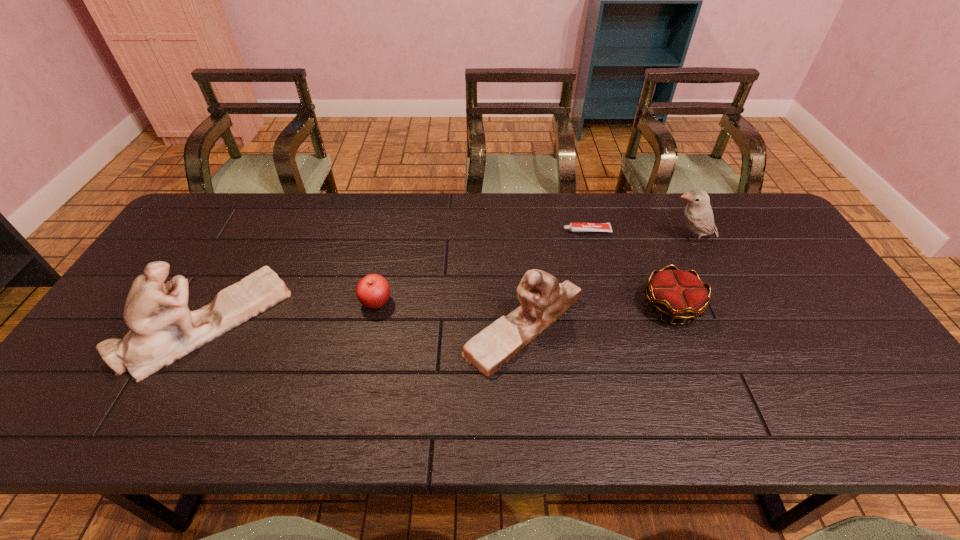
In order to click on free space between the shorter figurine and the tallest object in this screenshot , I will do `click(365, 326)`.

Locate an element on the screen. The image size is (960, 540). blank region between the apple and the right figurine is located at coordinates (449, 315).

You are a GUI agent. You are given a task and a screenshot of the screen. Output one action in this format:
    pyautogui.click(x=<x>, y=<y>)
    Task: Click on the vacant area that lies between the apple and the shortest object
    This screenshot has height=540, width=960.
    Given the screenshot: What is the action you would take?
    [481, 267]

What are the coordinates of `free area in between the bird and the shortest object` in the screenshot? It's located at (638, 236).

I want to click on empty space that is in between the bird and the toothpaste, so click(x=638, y=236).

Where is `empty space that is in between the bird and the taller figurine`? empty space that is in between the bird and the taller figurine is located at coordinates (448, 282).

Image resolution: width=960 pixels, height=540 pixels. In order to click on vacant space that's between the right figurine and the crown in this screenshot , I will do `click(597, 317)`.

Image resolution: width=960 pixels, height=540 pixels. Find the location of `vacant area that lies between the tallest object and the crown`. vacant area that lies between the tallest object and the crown is located at coordinates coord(439,315).

Identify the location of free space between the shorter figurine and the left figurine. Image resolution: width=960 pixels, height=540 pixels. (365, 326).

Point out which object is positioned as the nearest to the apple. Please provide its 2D coordinates. Your answer should be formatted as a tuple, i.e. [(x, y)], where the tuple contains the x and y coordinates of a point satisfying the conditions above.

[(543, 299)]